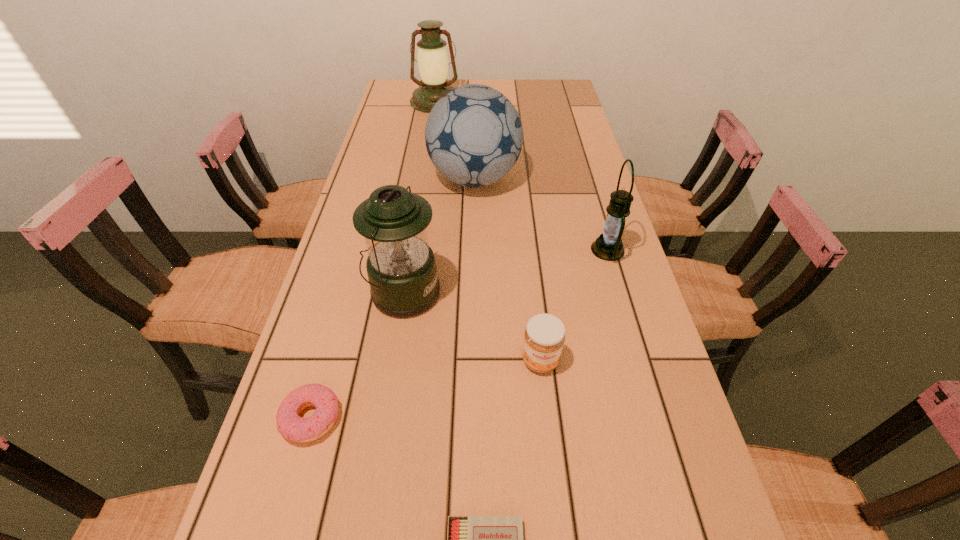
Locate an element on the screen. The image size is (960, 540). object positioned at the far left corner is located at coordinates coord(432,58).

Find the location of a particular element. free space at the far edge of the desktop is located at coordinates (508, 94).

Identify the location of vacant region at the left edge of the desktop. (327, 467).

You are a GUI agent. You are given a task and a screenshot of the screen. Output one action in this format:
    pyautogui.click(x=<x>, y=<y>)
    Task: Click on the vacant space at the right edge of the desktop
    The image size is (960, 540).
    Given the screenshot: What is the action you would take?
    pyautogui.click(x=541, y=149)

At what (x,y) coordinates should I click in order to perform the action: click on vacant space that is in between the second shortest object and the second nearest lantern. Please return your answer as a coordinate pair (x, y). Looking at the image, I should click on (460, 334).

Find the location of a particular element. vacant area that lies between the rightmost lantern and the second nearest object is located at coordinates (460, 334).

The image size is (960, 540). What are the coordinates of `vacant space that is in between the jam and the rightmost lantern` in the screenshot? It's located at (574, 305).

This screenshot has height=540, width=960. What are the coordinates of `vacant area that lies between the second farthest lantern and the farthest object` in the screenshot? It's located at (521, 176).

The height and width of the screenshot is (540, 960). I want to click on empty location between the soccer ball and the jam, so click(x=508, y=270).

You are a GUI agent. You are given a task and a screenshot of the screen. Output one action in this format:
    pyautogui.click(x=<x>, y=<y>)
    Task: Click on the vacant region between the jam and the second farthest object
    
    Given the screenshot: What is the action you would take?
    pyautogui.click(x=508, y=270)